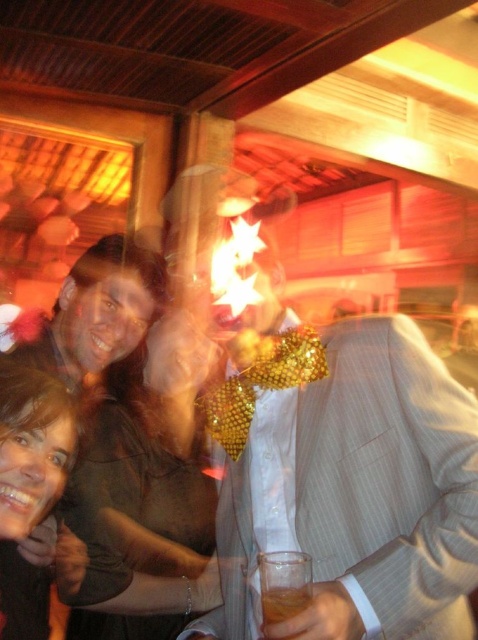
Is pinstriped suit at center to the left of matte gold star at upper center from the viewer's perspective?

In fact, pinstriped suit at center is to the right of matte gold star at upper center.

Between point (332, 392) and point (61, 554), which one is positioned behind?

Positioned behind is point (61, 554).

Which is behind, point (470, 400) or point (45, 593)?

Positioned behind is point (45, 593).

This screenshot has width=478, height=640. I want to click on pinstriped suit at center, so click(x=346, y=481).

Is point (43, 579) positioned after point (304, 609)?

Yes, point (43, 579) is farther from viewer.

Measure the distance between point [112,572] and camera.

Point [112,572] is 1.48 meters from camera.

Is point (119, 381) closer to camera compared to point (261, 612)?

That is False.

I want to click on matte gold star at upper center, so click(x=98, y=412).

Is point (117, 364) positioned behind point (280, 604)?

Yes.

Who is higher up, matte black dress at center or translucent amber liquid at lower center?

translucent amber liquid at lower center is higher up.

Find the location of `matte black dress at center`. matte black dress at center is located at coordinates (144, 481).